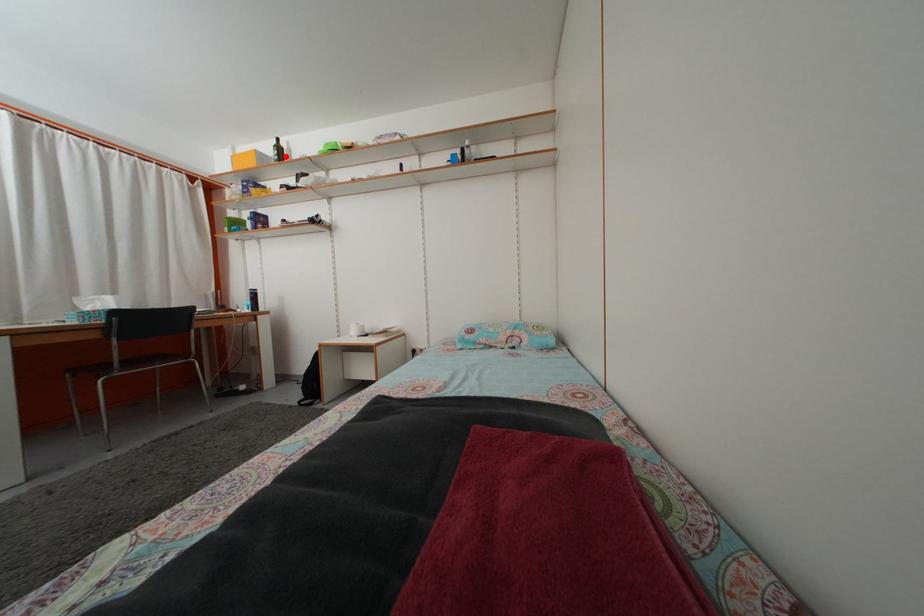
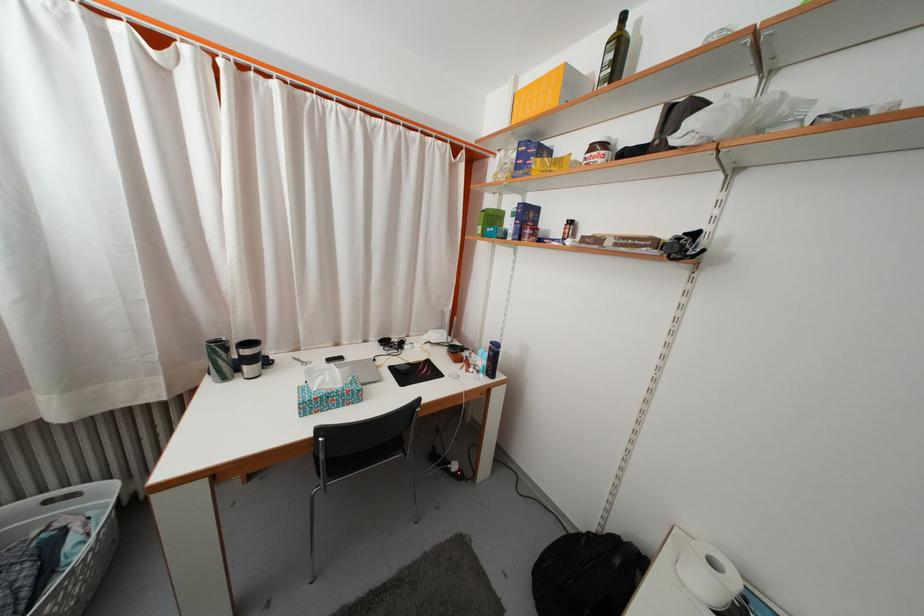
In the second image, find the point that corresponds to the highlighted location in the first image.

(625, 54)